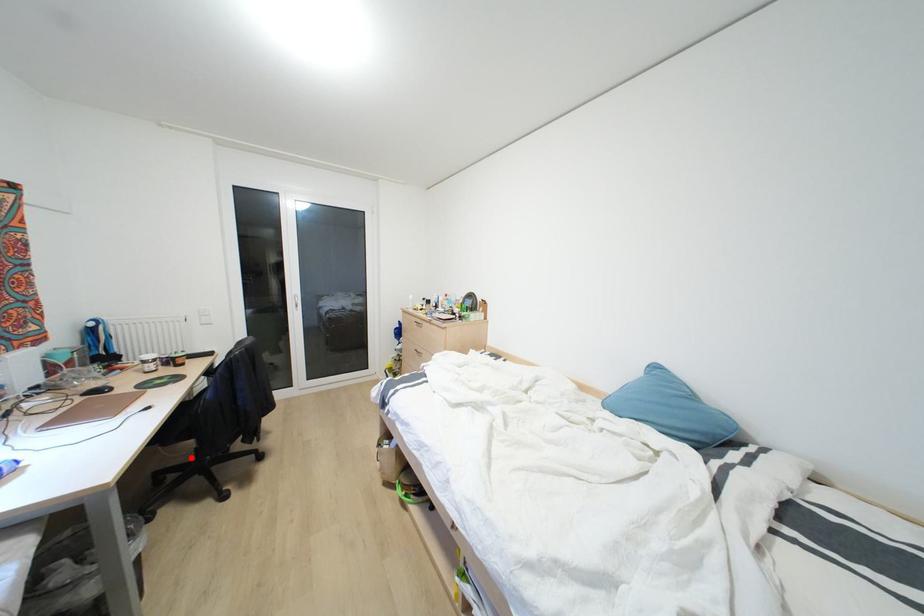
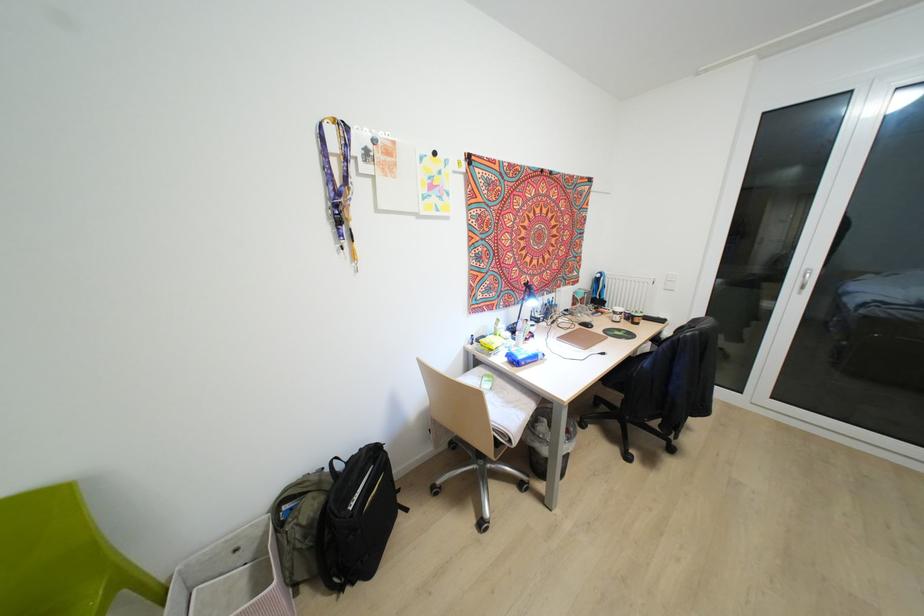
Question: I am providing you with two images of the same scene from different viewpoints. Image1 has a red point marked. In image2, the corresponding 3D location appears at what relative position? Reply with the corresponding letter.

Choices:
 (A) Closer
 (B) Farther

Answer: (A)